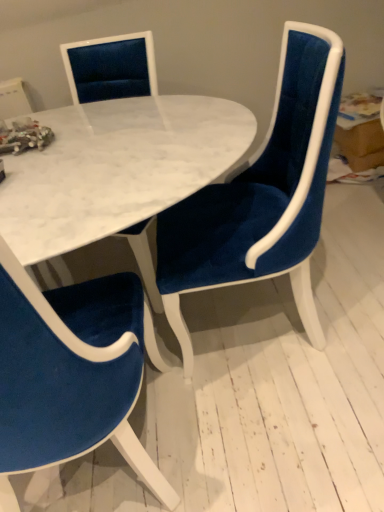
At what (x,y) coordinates should I click in order to perform the action: click on white marble table at center. Please return your answer as a coordinate pair (x, y). Looking at the image, I should click on (116, 168).

Locate an element on the screen. This screenshot has height=512, width=384. velvet blue chair at center, the 1th chair viewed from the right is located at coordinates [x=262, y=194].

Locate an element on the screen. Image resolution: width=384 pixels, height=512 pixels. white marble table at center is located at coordinates (116, 168).

At what (x,y) coordinates should I click in order to perform the action: click on the 2nd chair directly beneath the white marble table at center (from a real-world perspective). Please return your answer as a coordinate pair (x, y). This screenshot has height=512, width=384. Looking at the image, I should click on (262, 194).

Based on their positions, is white marble table at center located to the left or right of velvet blue chair at center, the 2th chair from the left?

white marble table at center is to the left of velvet blue chair at center, the 2th chair from the left.

Considering the sizes of objects white marble table at center and velvet blue chair at center, the 2th chair from the left, in the image provided, who is bigger, white marble table at center or velvet blue chair at center, the 2th chair from the left,?

velvet blue chair at center, the 2th chair from the left.

From the image's perspective, between white marble table at center and velvet blue chair at center, the 2th chair from the left, who is located below?

velvet blue chair at center, the 2th chair from the left, is shown below in the image.

Considering the sizes of velvet blue chair at lower left, placed as the 1th chair when sorted from left to right, and velvet blue chair at center, the 1th chair viewed from the right, in the image, is velvet blue chair at lower left, placed as the 1th chair when sorted from left to right, bigger or smaller than velvet blue chair at center, the 1th chair viewed from the right,?

In the image, velvet blue chair at lower left, placed as the 1th chair when sorted from left to right, appears to be larger than velvet blue chair at center, the 1th chair viewed from the right.

From the image's perspective, is velvet blue chair at lower left, positioned as the second chair in right-to-left order, above or below velvet blue chair at center, the 2th chair from the left?

velvet blue chair at lower left, positioned as the second chair in right-to-left order, is situated lower than velvet blue chair at center, the 2th chair from the left, in the image.

Measure the distance from velvet blue chair at lower left, positioned as the second chair in right-to-left order, to velvet blue chair at center, the 1th chair viewed from the right.

17.38 inches.

In the scene shown: Considering the sizes of velvet blue chair at center, the 1th chair viewed from the right, and velvet blue chair at lower left, positioned as the second chair in right-to-left order, in the image, is velvet blue chair at center, the 1th chair viewed from the right, taller or shorter than velvet blue chair at lower left, positioned as the second chair in right-to-left order,?

Considering their sizes, velvet blue chair at center, the 1th chair viewed from the right, has less height than velvet blue chair at lower left, positioned as the second chair in right-to-left order.

Is velvet blue chair at center, the 2th chair from the left, not near velvet blue chair at lower left, positioned as the second chair in right-to-left order?

That's not correct — velvet blue chair at center, the 2th chair from the left, is a little close to velvet blue chair at lower left, positioned as the second chair in right-to-left order.

Is point (231, 282) positioned behind point (161, 496)?

Yes, it is.

Which of these two, white marble table at center or velvet blue chair at lower left, positioned as the second chair in right-to-left order, is thinner?

white marble table at center.

Looking at this image, considering the relative positions of white marble table at center and velvet blue chair at lower left, positioned as the second chair in right-to-left order, in the image provided, is white marble table at center behind velvet blue chair at lower left, positioned as the second chair in right-to-left order,?

Yes, white marble table at center is further from the camera.

Is white marble table at center beside velvet blue chair at lower left, positioned as the second chair in right-to-left order?

No, white marble table at center is not with velvet blue chair at lower left, positioned as the second chair in right-to-left order.

Can we say white marble table at center lies outside velvet blue chair at lower left, placed as the 1th chair when sorted from left to right?

That's correct, white marble table at center is outside of velvet blue chair at lower left, placed as the 1th chair when sorted from left to right.

Between velvet blue chair at lower left, positioned as the second chair in right-to-left order, and white marble table at center, which one has larger width?

With larger width is velvet blue chair at lower left, positioned as the second chair in right-to-left order.

Would you consider velvet blue chair at lower left, placed as the 1th chair when sorted from left to right, to be distant from white marble table at center?

velvet blue chair at lower left, placed as the 1th chair when sorted from left to right, is near white marble table at center, not far away.

Which is farther, (146, 465) or (107, 175)?

The point (107, 175) is more distant.

Identify the location of the 1st chair located beneath the white marble table at center (from a real-world perspective). Image resolution: width=384 pixels, height=512 pixels. (72, 373).

Considering the relative sizes of velvet blue chair at center, the 1th chair viewed from the right, and white marble table at center in the image provided, is velvet blue chair at center, the 1th chair viewed from the right, taller than white marble table at center?

Correct, velvet blue chair at center, the 1th chair viewed from the right, is much taller as white marble table at center.

Identify the location of table above the velvet blue chair at center, the 2th chair from the left (from a real-world perspective). pos(116,168).

Can you confirm if velvet blue chair at center, the 2th chair from the left, is thinner than white marble table at center?

No.

From the image's perspective, is velvet blue chair at center, the 1th chair viewed from the right, positioned above or below white marble table at center?

From the image's perspective, velvet blue chair at center, the 1th chair viewed from the right, appears below white marble table at center.

Where is `table behind the velvet blue chair at center, the 1th chair viewed from the right`? table behind the velvet blue chair at center, the 1th chair viewed from the right is located at coordinates (116, 168).

The width and height of the screenshot is (384, 512). I want to click on chair on the right of velvet blue chair at lower left, placed as the 1th chair when sorted from left to right, so click(262, 194).

Estimate the real-world distances between objects in this image. Which object is closer to velvet blue chair at center, the 1th chair viewed from the right, velvet blue chair at lower left, placed as the 1th chair when sorted from left to right, or white marble table at center?

white marble table at center is positioned closer to the anchor velvet blue chair at center, the 1th chair viewed from the right.

Considering their positions, is white marble table at center positioned closer to velvet blue chair at center, the 2th chair from the left, than velvet blue chair at lower left, positioned as the second chair in right-to-left order?

Based on the image, white marble table at center appears to be nearer to velvet blue chair at center, the 2th chair from the left.

Estimate the real-world distances between objects in this image. Which object is further from velvet blue chair at lower left, placed as the 1th chair when sorted from left to right, velvet blue chair at center, the 2th chair from the left, or white marble table at center?

The object further to velvet blue chair at lower left, placed as the 1th chair when sorted from left to right, is velvet blue chair at center, the 2th chair from the left.

Estimate the real-world distances between objects in this image. Which object is further from velvet blue chair at lower left, placed as the 1th chair when sorted from left to right, white marble table at center or velvet blue chair at center, the 2th chair from the left?

velvet blue chair at center, the 2th chair from the left.

From the picture: Which object lies further to the anchor point white marble table at center, velvet blue chair at lower left, positioned as the second chair in right-to-left order, or velvet blue chair at center, the 2th chair from the left?

velvet blue chair at lower left, positioned as the second chair in right-to-left order, is further to white marble table at center.

Which object lies further to the anchor point white marble table at center, velvet blue chair at center, the 1th chair viewed from the right, or velvet blue chair at lower left, positioned as the second chair in right-to-left order?

Based on the image, velvet blue chair at lower left, positioned as the second chair in right-to-left order, appears to be further to white marble table at center.

Where is `chair between velvet blue chair at lower left, placed as the 1th chair when sorted from left to right, and white marble table at center in the front-back direction`? Image resolution: width=384 pixels, height=512 pixels. chair between velvet blue chair at lower left, placed as the 1th chair when sorted from left to right, and white marble table at center in the front-back direction is located at coordinates (262, 194).